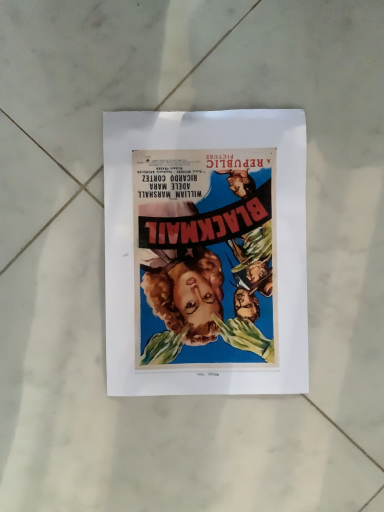
Question: Should I look upward or downward to see vibrant paper poster at center?

Choices:
 (A) down
 (B) up

Answer: (B)